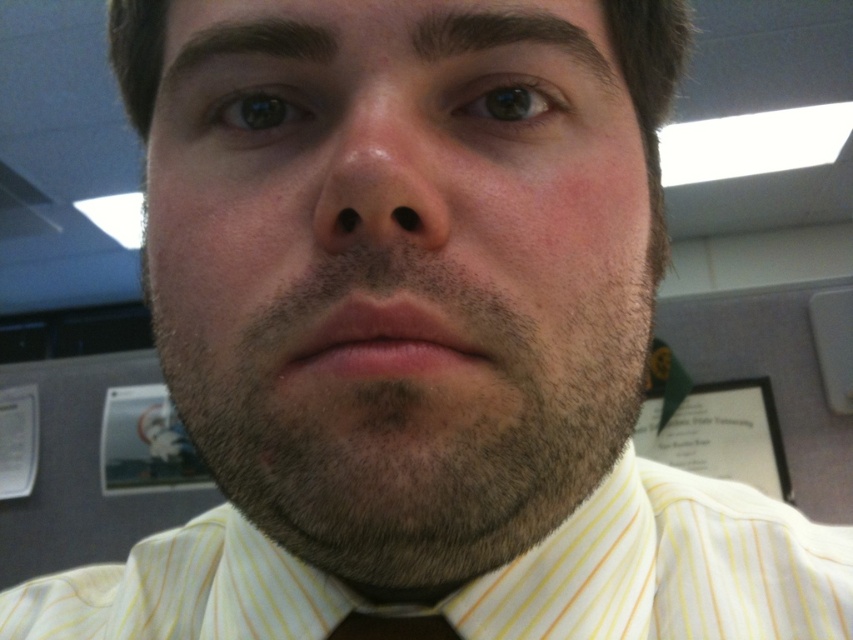
Looking at this image, you are an artist sketching the person in the image. You notice the yellow striped shirt at center and the pinkish skin nose at center. Which object is closer to the viewer?

The yellow striped shirt at center is closer to the viewer than the pinkish skin nose at center because the nose is behind the shirt.

You are a tailor adjusting the fit of clothing for a client. You notice the yellow striped shirt at center and the black satin tie at center. Which clothing item is positioned higher on the client?

The yellow striped shirt at center is located above the black satin tie at center, so the yellow striped shirt at center is positioned higher on the client.